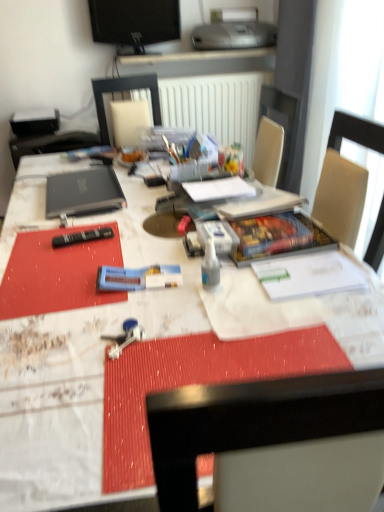
I want to click on vacant space situated on the left part of transparent plastic bottle at center, so click(x=146, y=290).